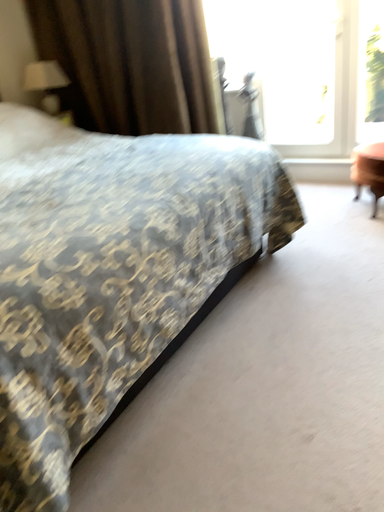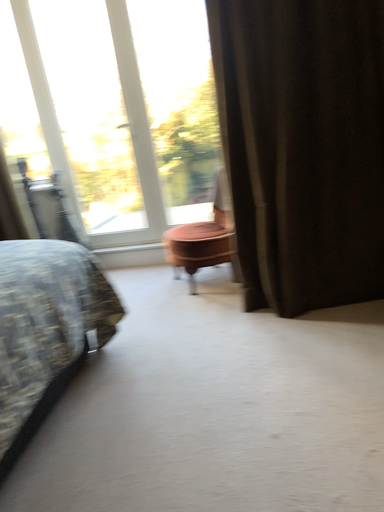
Question: How did the camera likely rotate when shooting the video?

Choices:
 (A) rotated upward
 (B) rotated downward

Answer: (A)